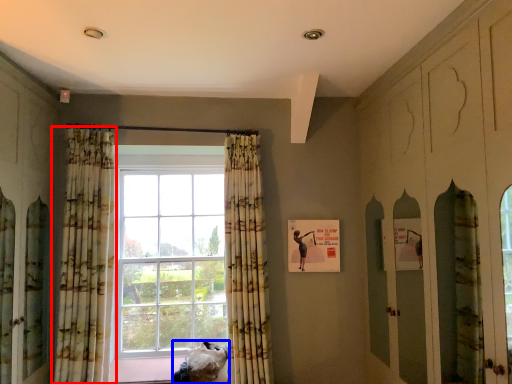
Question: Which object is closer to the camera taking this photo, curtain (highlighted by a red box) or furniture (highlighted by a blue box)?

Choices:
 (A) curtain
 (B) furniture

Answer: (A)